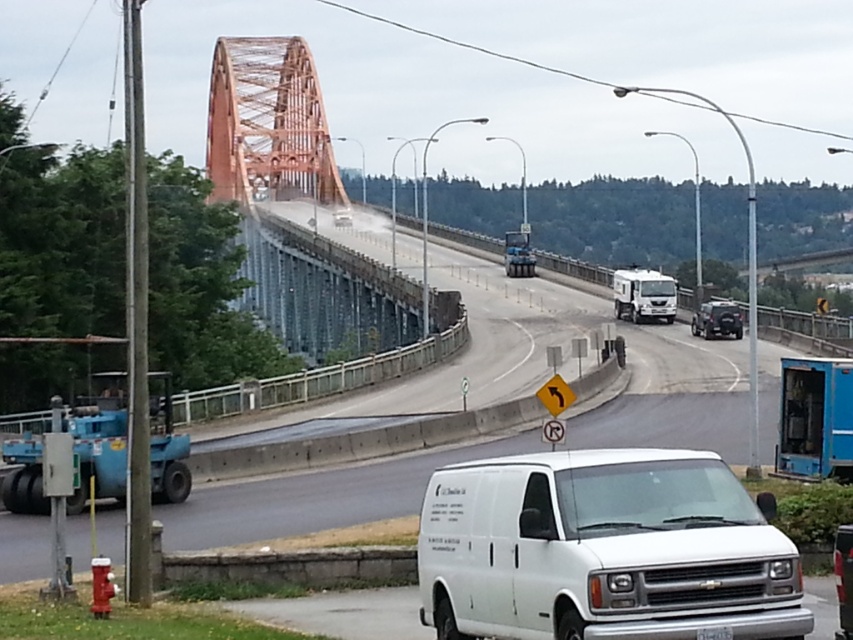
Which is more to the left, white matte van at lower center or white matte truck at center?

white matte van at lower center

This screenshot has width=853, height=640. Describe the element at coordinates (604, 548) in the screenshot. I see `white matte van at lower center` at that location.

You are a GUI agent. You are given a task and a screenshot of the screen. Output one action in this format:
    pyautogui.click(x=<x>, y=<y>)
    Task: Click on the white matte van at lower center
    
    Given the screenshot: What is the action you would take?
    pyautogui.click(x=604, y=548)

Who is more distant from viewer, [287,161] or [613,296]?

The point [287,161] is more distant.

Is orange metallic bridge at upper center positioned before white matte truck at center?

Yes, it is.

Is point (247, 38) positioned before point (619, 301)?

No, it is not.

Where is `orange metallic bridge at upper center`? orange metallic bridge at upper center is located at coordinates (267, 122).

Between point (659, 385) and point (648, 314), which one is positioned behind?

The point (648, 314) is behind.

I want to click on white glossy van at center, so click(x=387, y=413).